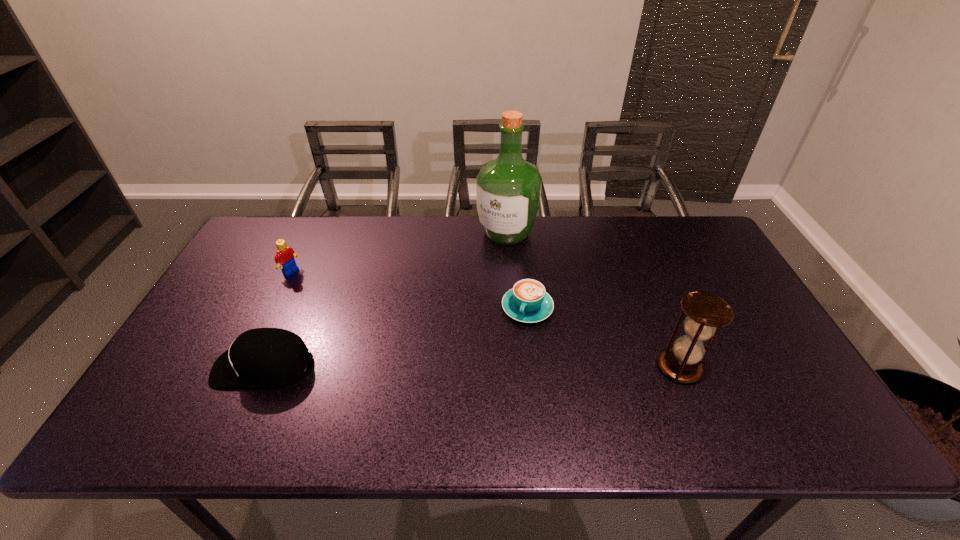
You are a GUI agent. You are given a task and a screenshot of the screen. Output one action in this format:
    pyautogui.click(x=<x>, y=<y>)
    Task: Click on the free region at the right edge of the desktop
    
    Given the screenshot: What is the action you would take?
    pyautogui.click(x=691, y=280)

Image resolution: width=960 pixels, height=540 pixels. What are the coordinates of `vacant space at the far left corner of the desktop` in the screenshot? It's located at (261, 226).

You are a GUI agent. You are given a task and a screenshot of the screen. Output one action in this format:
    pyautogui.click(x=<x>, y=<y>)
    Task: Click on the vacant point at the near left corner
    Image resolution: width=960 pixels, height=540 pixels.
    Given the screenshot: What is the action you would take?
    pyautogui.click(x=194, y=386)

The height and width of the screenshot is (540, 960). I want to click on vacant area at the far right corner of the desktop, so click(x=700, y=240).

Where is `vacant area that lies between the third farthest object and the fourth tallest object`? vacant area that lies between the third farthest object and the fourth tallest object is located at coordinates (396, 337).

Image resolution: width=960 pixels, height=540 pixels. I want to click on unoccupied position between the shortest object and the hourglass, so click(x=603, y=338).

Image resolution: width=960 pixels, height=540 pixels. I want to click on vacant area that lies between the shortest object and the fourth shortest object, so click(x=603, y=338).

Find the location of a particular element. vacant space that's between the cap and the rightmost object is located at coordinates (471, 367).

Where is `free space that is in between the liquor and the third shortest object`? This screenshot has height=540, width=960. free space that is in between the liquor and the third shortest object is located at coordinates (398, 252).

Locate an element on the screen. The width and height of the screenshot is (960, 540). free area in between the tallest object and the cap is located at coordinates (385, 300).